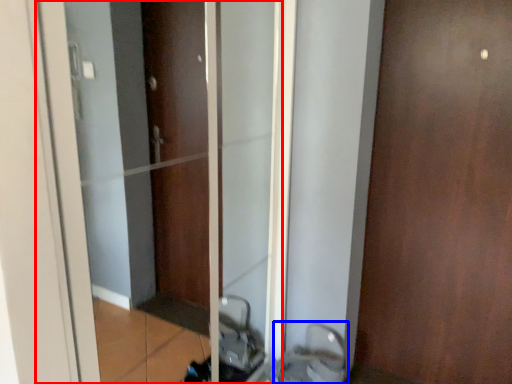
Question: Which point is further to the camera, elevator (highlighted by a red box) or sink (highlighted by a blue box)?

Choices:
 (A) elevator
 (B) sink

Answer: (B)